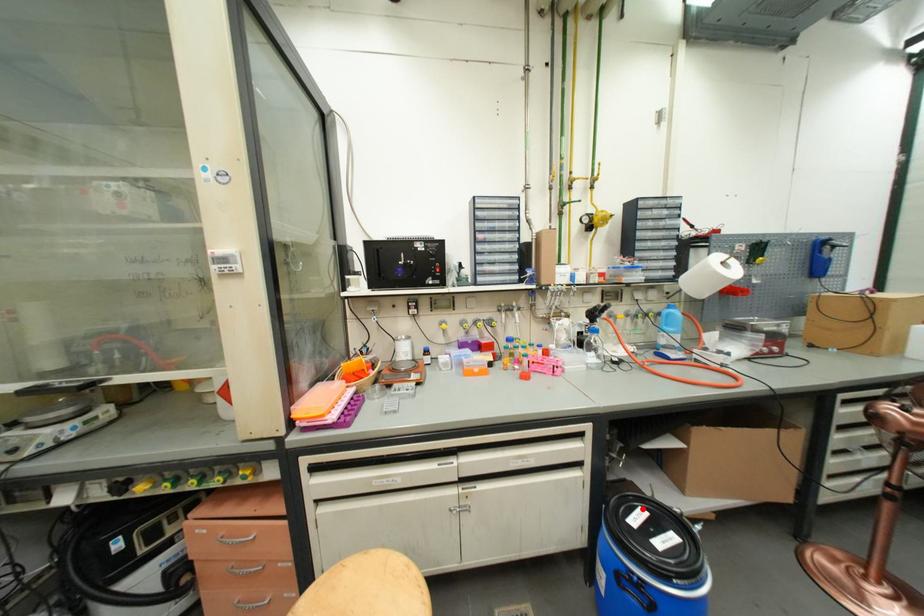
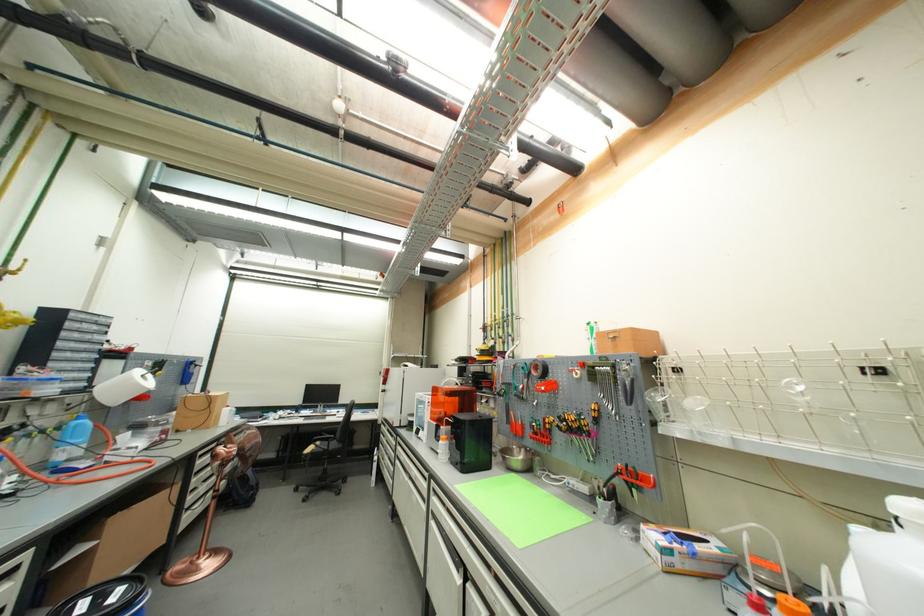
Locate, in the second image, the point that corresponds to the highlighted location in the first image.

(80, 606)